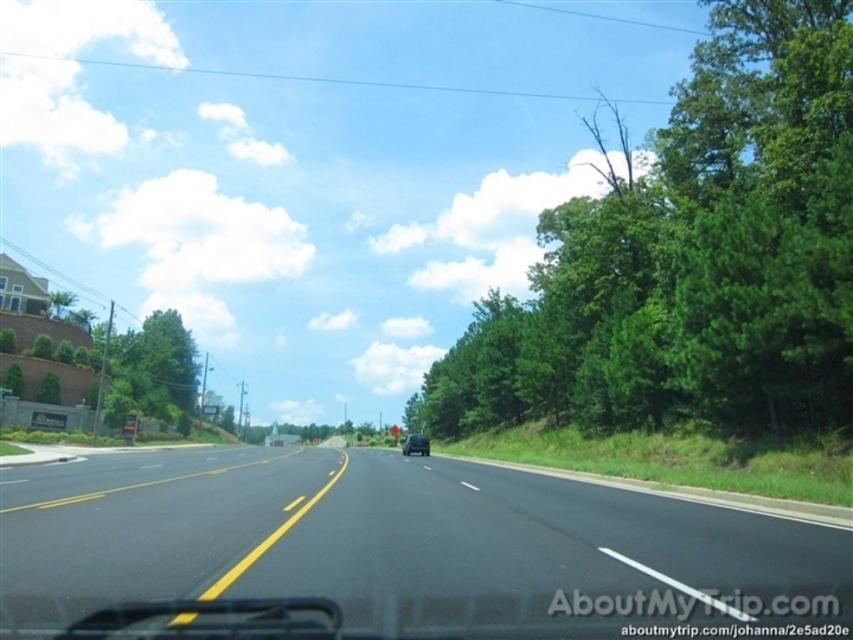
Can you confirm if green leafy tree at right is positioned below black asphalt highway at center?

No.

Can you confirm if green leafy tree at right is thinner than black asphalt highway at center?

No.

This screenshot has width=853, height=640. What are the coordinates of `green leafy tree at right` in the screenshot? It's located at (691, 257).

Can you confirm if green leafy tree at right is wider than black matte car at center?

Correct, the width of green leafy tree at right exceeds that of black matte car at center.

Who is positioned more to the right, green leafy tree at right or black matte car at center?

From the viewer's perspective, green leafy tree at right appears more on the right side.

The image size is (853, 640). What are the coordinates of `green leafy tree at right` in the screenshot? It's located at click(691, 257).

Can you confirm if black asphalt highway at center is wider than black matte car at center?

Yes, black asphalt highway at center is wider than black matte car at center.

Is point (799, 552) farther from camera compared to point (405, 440)?

No, it is not.

Does point (9, 518) come farther from viewer compared to point (403, 445)?

No, it is not.

You are a GUI agent. You are given a task and a screenshot of the screen. Output one action in this format:
    pyautogui.click(x=<x>, y=<y>)
    Task: Click on the black asphalt highway at center
    The width and height of the screenshot is (853, 640).
    Given the screenshot: What is the action you would take?
    pyautogui.click(x=393, y=540)